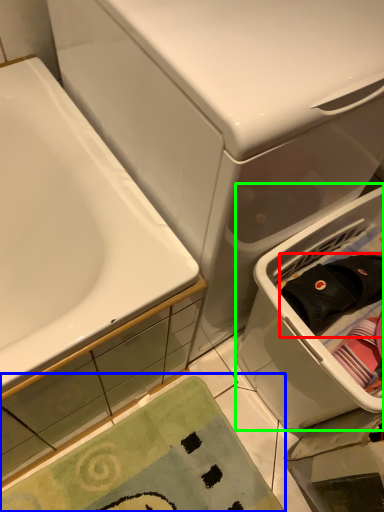
Question: Estimate the real-world distances between objects in this image. Which object is farther from clothing (highlighted by a red box), bath mat (highlighted by a blue box) or laundry basket (highlighted by a green box)?

Choices:
 (A) bath mat
 (B) laundry basket

Answer: (A)